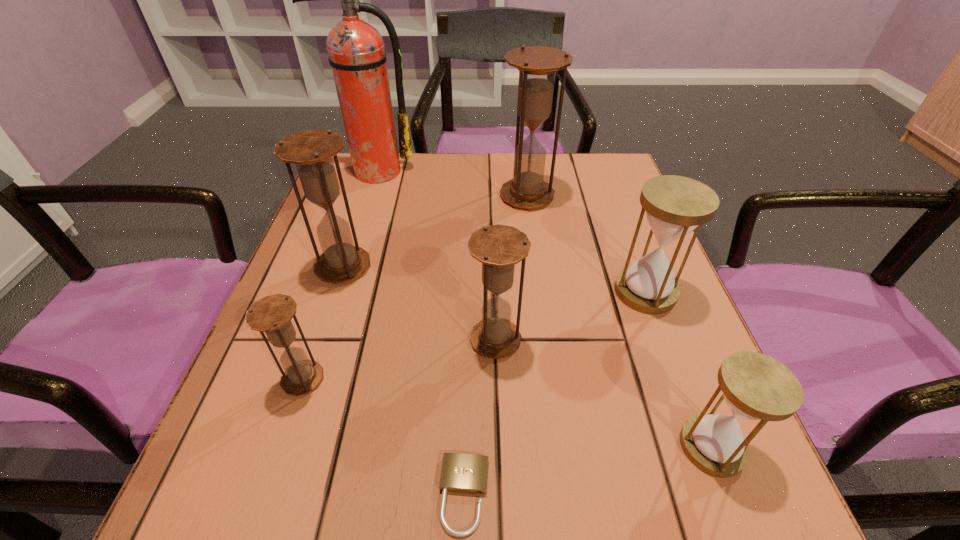
In the image, there is a desktop. Find the location of `vacant space at the left edge`. vacant space at the left edge is located at coordinates (330, 373).

Locate an element on the screen. Image resolution: width=960 pixels, height=540 pixels. vacant space at the right edge of the desktop is located at coordinates (680, 407).

I want to click on vacant space at the far left corner, so click(344, 200).

Identify the location of free spot at the far right corner of the desktop. (581, 192).

I want to click on free region at the near right corner, so click(x=739, y=505).

Identify the location of free space between the beige padlock and the fire extinguisher. (420, 333).

Where is `free space between the third tallest object and the smaller white hourglass`? The height and width of the screenshot is (540, 960). free space between the third tallest object and the smaller white hourglass is located at coordinates (528, 356).

I want to click on blank region between the tallest object and the shortest object, so click(x=420, y=333).

This screenshot has height=540, width=960. Identify the location of vacant area between the padlock and the tallest object. pyautogui.click(x=420, y=333).

Find the location of `empty space between the farthest brown hourglass and the bigger white hourglass`. empty space between the farthest brown hourglass and the bigger white hourglass is located at coordinates (587, 244).